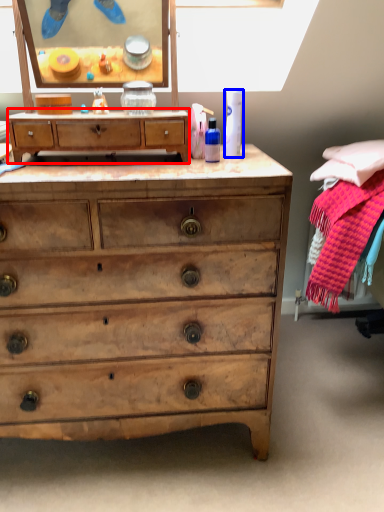
Question: Which point is further to the camera, chest of drawers (highlighted by a red box) or toiletry (highlighted by a blue box)?

Choices:
 (A) chest of drawers
 (B) toiletry

Answer: (B)